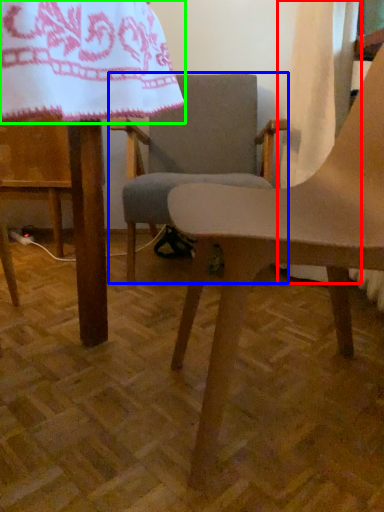
Question: Which object is positioned farthest from curtain (highlighted by a red box)? Select from chair (highlighted by a blue box) and blanket (highlighted by a green box).

Choices:
 (A) chair
 (B) blanket

Answer: (B)